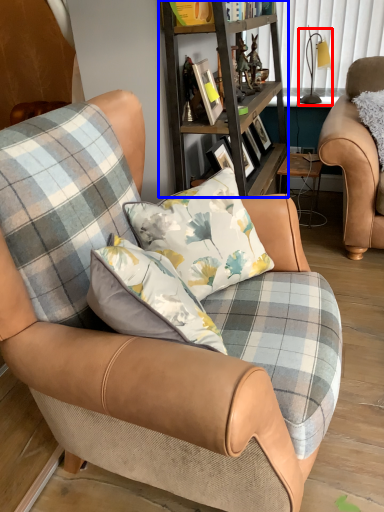
Question: Which object appears farthest to the camera in this image, lamp (highlighted by a red box) or shelf (highlighted by a blue box)?

Choices:
 (A) lamp
 (B) shelf

Answer: (A)